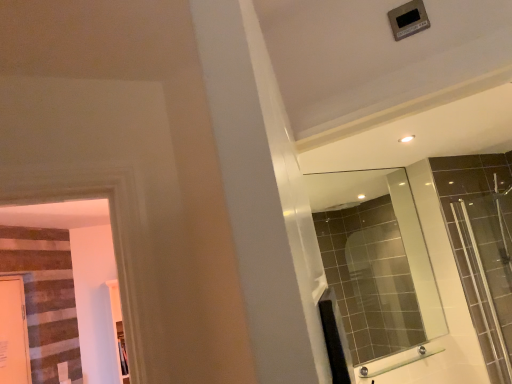
The width and height of the screenshot is (512, 384). Identify the location of clear glass shower door at right. (458, 233).

This screenshot has height=384, width=512. Describe the element at coordinates (458, 233) in the screenshot. I see `clear glass shower door at right` at that location.

Where is `clear glass shower door at right`? clear glass shower door at right is located at coordinates (458, 233).